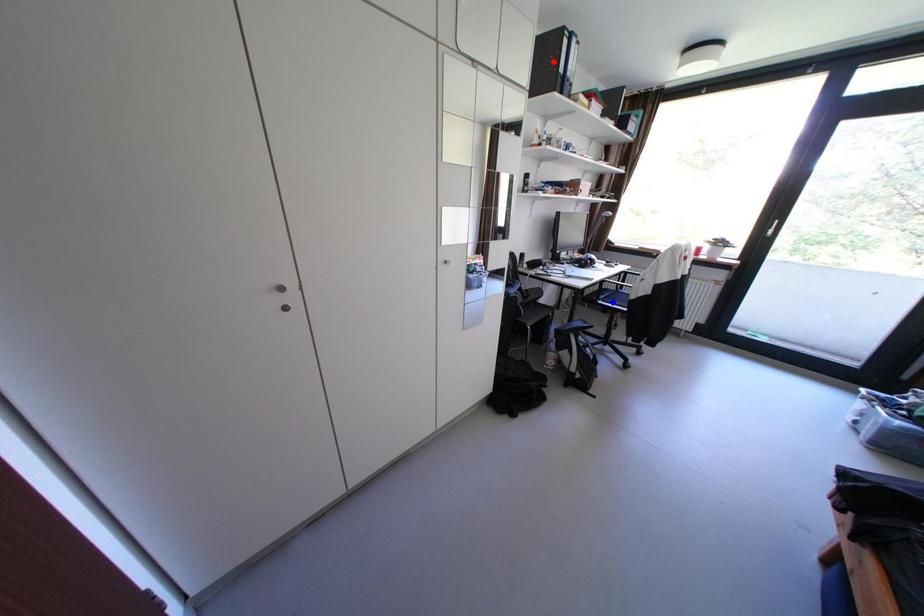
Question: In the image, two points are highlighted. Which point is nearer to the camera? Reply with the corresponding letter.

Choices:
 (A) blue point
 (B) red point

Answer: (B)